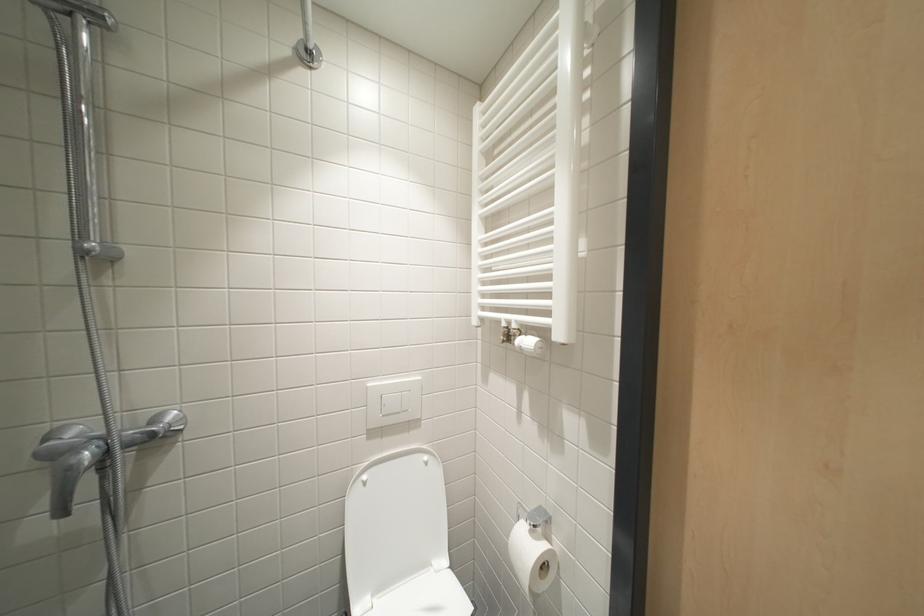
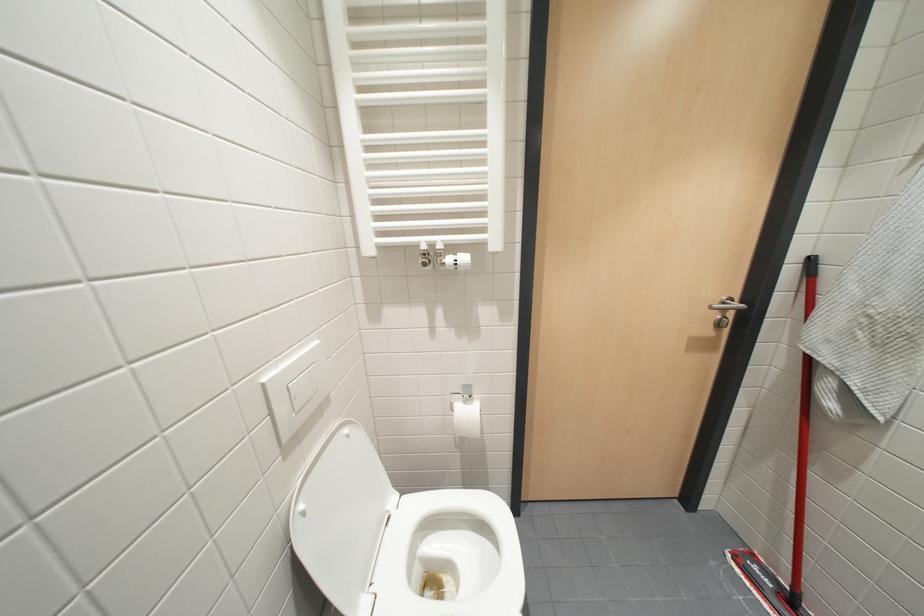
Based on the continuous images, in which direction is the camera rotating?

The camera rotated toward right-down.